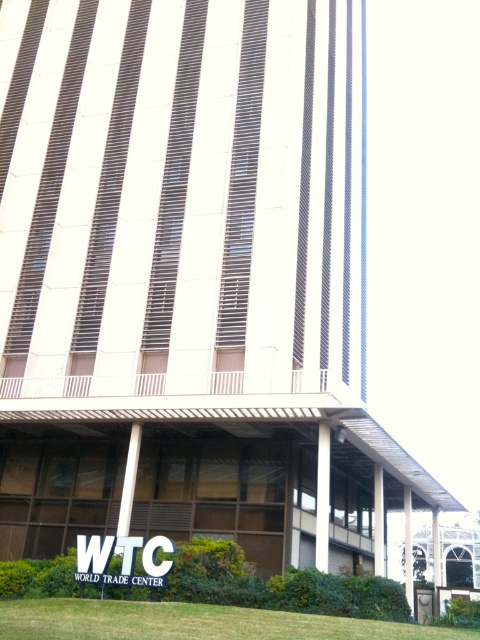
You are standing at the point marked as point (x=192, y=621) in the image. What do you see directly below you?

At point (x=192, y=621) lies green grass at lower center.

You are a maintenance worker assigned to mow the lawn in front of the building. You see the green grass at lower center and the white plastic sign at center. Which object is taller and needs to be trimmed first?

The green grass at lower center is taller than the white plastic sign at center, so it needs to be trimmed first.